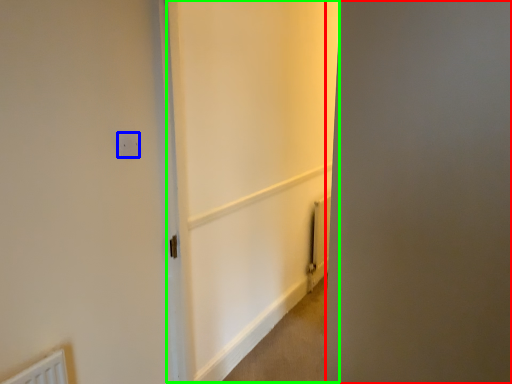
Question: Which object is positioned closest to screen door (highlighted by a red box)? Select from electric outlet (highlighted by a blue box) and screen door (highlighted by a green box).

Choices:
 (A) electric outlet
 (B) screen door

Answer: (A)